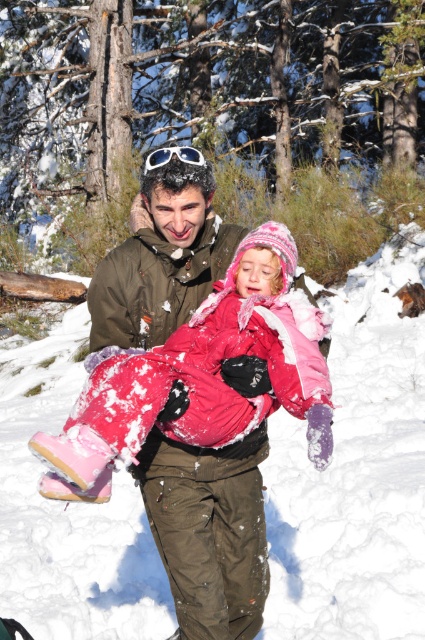
Which of these two, white fluffy snow at center or white matte goggles at upper center, stands taller?

white matte goggles at upper center

Does white fluffy snow at center have a smaller size compared to white matte goggles at upper center?

Yes, white fluffy snow at center is smaller than white matte goggles at upper center.

Is point (115, 538) in front of point (153, 163)?

No, (115, 538) is further to viewer.

Image resolution: width=425 pixels, height=640 pixels. In order to click on white fluffy snow at center in this screenshot , I will do `click(356, 472)`.

Does fluffy pink snowsuit at center appear on the left side of white matte goggles at upper center?

In fact, fluffy pink snowsuit at center is to the right of white matte goggles at upper center.

Is fluffy pink snowsuit at center above white matte goggles at upper center?

No, fluffy pink snowsuit at center is not above white matte goggles at upper center.

Which is behind, point (204, 417) or point (178, 147)?

The point (178, 147) is behind.

Identify the location of fluffy pink snowsuit at center. (201, 376).

Image resolution: width=425 pixels, height=640 pixels. What do you see at coordinates (356, 472) in the screenshot?
I see `white fluffy snow at center` at bounding box center [356, 472].

Who is positioned more to the right, white fluffy snow at center or fluffy pink snowsuit at center?

→ fluffy pink snowsuit at center is more to the right.

Who is more distant from viewer, (303, 456) or (190, 438)?

Positioned behind is point (303, 456).

Where is `white fluffy snow at center`? The height and width of the screenshot is (640, 425). white fluffy snow at center is located at coordinates (356, 472).